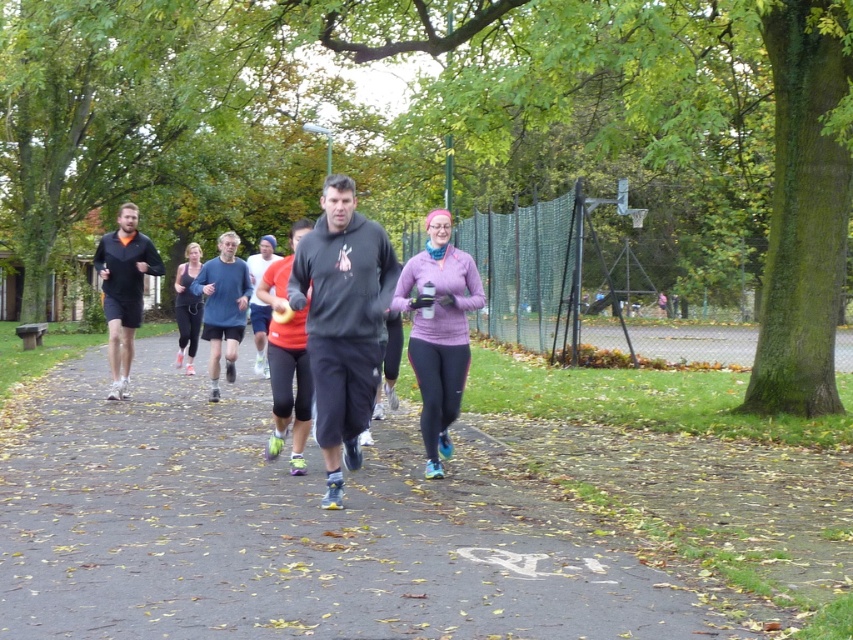
Question: Does smooth asphalt path at center have a smaller size compared to matte black shorts at left?

Choices:
 (A) yes
 (B) no

Answer: (B)

Question: Which point is closer to the camera taking this photo?

Choices:
 (A) (323, 305)
 (B) (262, 305)
 (C) (106, 269)
 (D) (206, 282)

Answer: (A)

Question: Among these objects, which one is farthest from the camera?

Choices:
 (A) matte black shorts at left
 (B) purple fleece jacket at center
 (C) red matte running shoes at center
 (D) dark gray hoodie at center

Answer: (A)

Question: Does matte black leggings at center appear over red matte running shoes at center?

Choices:
 (A) no
 (B) yes

Answer: (A)

Question: Which object appears farthest from the camera in this image?

Choices:
 (A) purple fleece jacket at center
 (B) smooth asphalt path at center

Answer: (A)

Question: Can you confirm if dark gray hoodie at center is smaller than red matte running shoes at center?

Choices:
 (A) yes
 (B) no

Answer: (A)